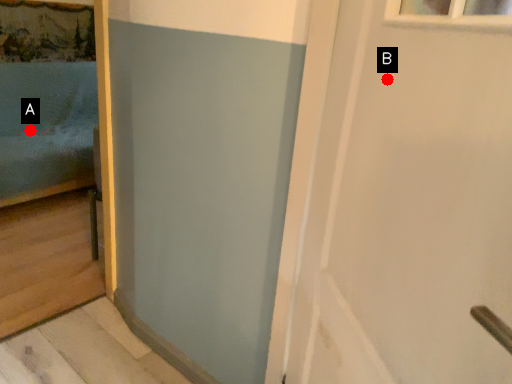
Question: Two points are circled on the image, labeled by A and B beside each circle. Among these points, which one is farthest from the camera?

Choices:
 (A) A is further
 (B) B is further

Answer: (A)